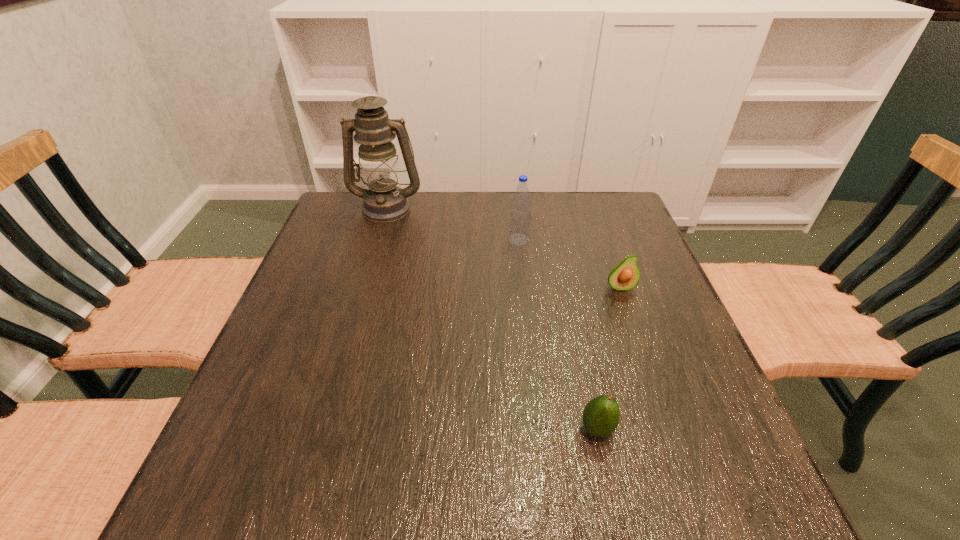
Locate an element on the screen. The width and height of the screenshot is (960, 540). the leftmost object is located at coordinates (384, 201).

Identify the location of the farthest object. The width and height of the screenshot is (960, 540). (384, 201).

This screenshot has width=960, height=540. I want to click on the second object from left to right, so click(x=520, y=218).

What are the coordinates of `the third nearest object` in the screenshot? It's located at (520, 218).

At what (x,y) coordinates should I click in order to perform the action: click on the rightmost object. Please return your answer as a coordinate pair (x, y). Looking at the image, I should click on (624, 276).

Where is `the farther avocado`? The width and height of the screenshot is (960, 540). the farther avocado is located at coordinates [624, 276].

In order to click on the nearer avocado in this screenshot , I will do `click(601, 415)`.

Identify the location of the third object from left to right. The image size is (960, 540). (601, 415).

Locate an element on the screen. The image size is (960, 540). free location located on the right of the tallest object is located at coordinates (460, 208).

Locate an element on the screen. free space located 0.100m on the back of the second tallest object is located at coordinates (516, 214).